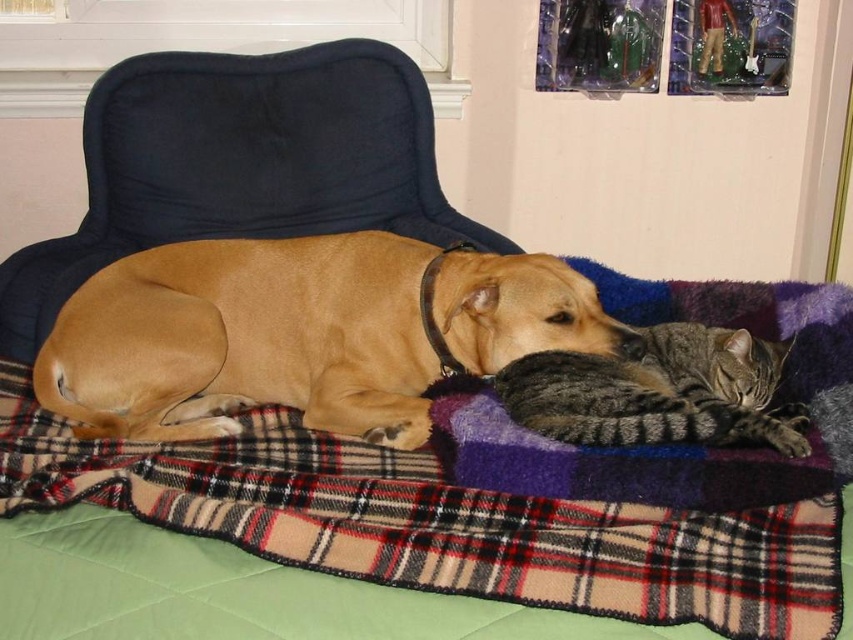
Question: Does plaid fabric at center appear on the right side of golden brown fur at center?

Choices:
 (A) yes
 (B) no

Answer: (B)

Question: In this image, where is plaid fabric at center located relative to gray striped fur cat at center?

Choices:
 (A) left
 (B) right

Answer: (A)

Question: Which object is the closest to the gray striped fur cat at center?

Choices:
 (A) plaid fabric at center
 (B) soft purple fleece cat bed at center
 (C) golden brown fur at center

Answer: (B)

Question: Among these points, which one is farthest from the camera?

Choices:
 (A) (434, 176)
 (B) (251, 276)

Answer: (A)

Question: Is suede-like tan armchair at upper center positioned behind gray striped fur cat at center?

Choices:
 (A) no
 (B) yes

Answer: (B)

Question: Which point is farther from the camera taking this photo?

Choices:
 (A) (749, 342)
 (B) (560, 273)
 (C) (473, 480)

Answer: (B)